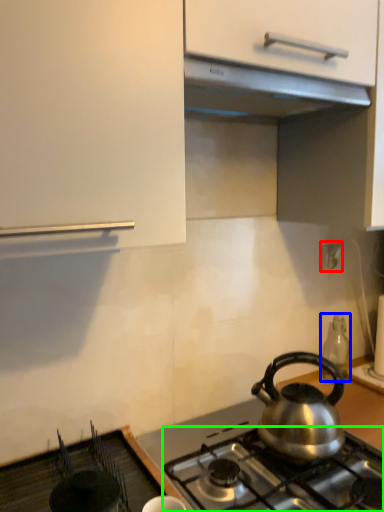
Question: Which object is the farthest from electric outlet (highlighted by a red box)? Choose among these: appliance (highlighted by a blue box) or gas stove (highlighted by a green box).

Choices:
 (A) appliance
 (B) gas stove

Answer: (B)